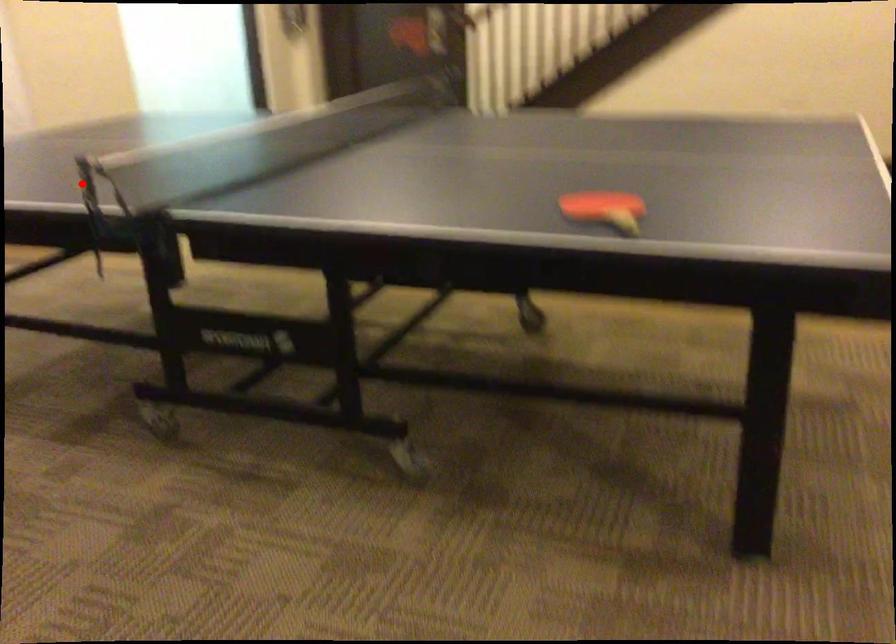
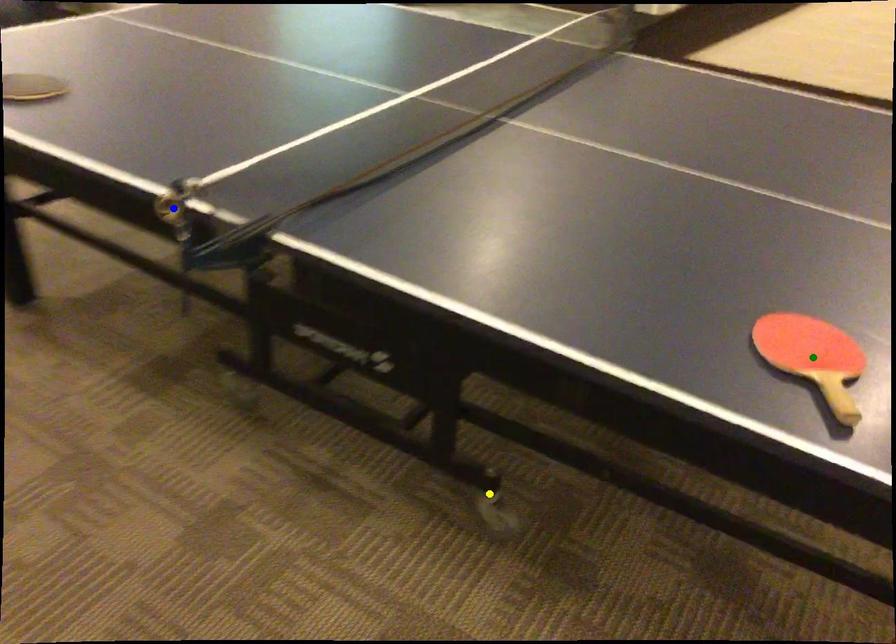
Question: I am providing you with two images of the same scene from different viewpoints. A red point is marked on the first image. You are given multiple points on the second image. Which spot in image 2 lines up with the point in image 1?

Choices:
 (A) yellow point
 (B) green point
 (C) blue point

Answer: (C)